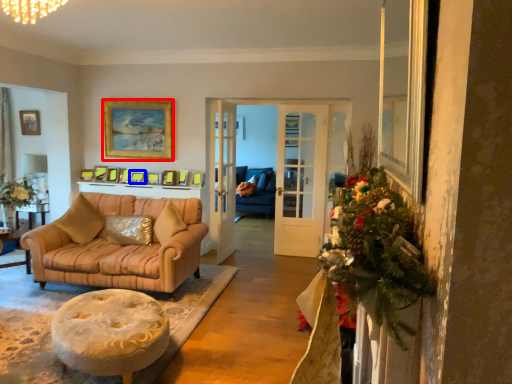
Question: Which object appears farthest to the camera in this image, picture frame (highlighted by a red box) or picture frame (highlighted by a blue box)?

Choices:
 (A) picture frame
 (B) picture frame

Answer: (B)